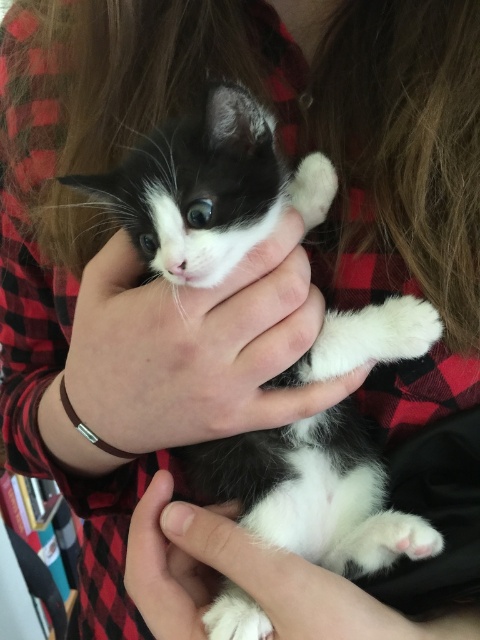
Is soft fur kitten at center positioned in front of white fur at center?

Yes, it is.

This screenshot has width=480, height=640. In order to click on soft fur kitten at center in this screenshot , I will do `click(210, 188)`.